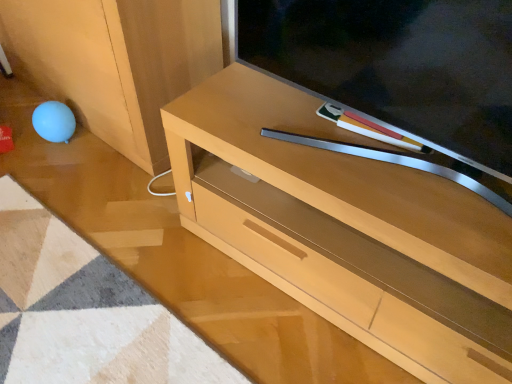
Find the location of a particular element. The height and width of the screenshot is (384, 512). free spot above light brown wood tv stand at center (from a real-world perspective) is located at coordinates (353, 148).